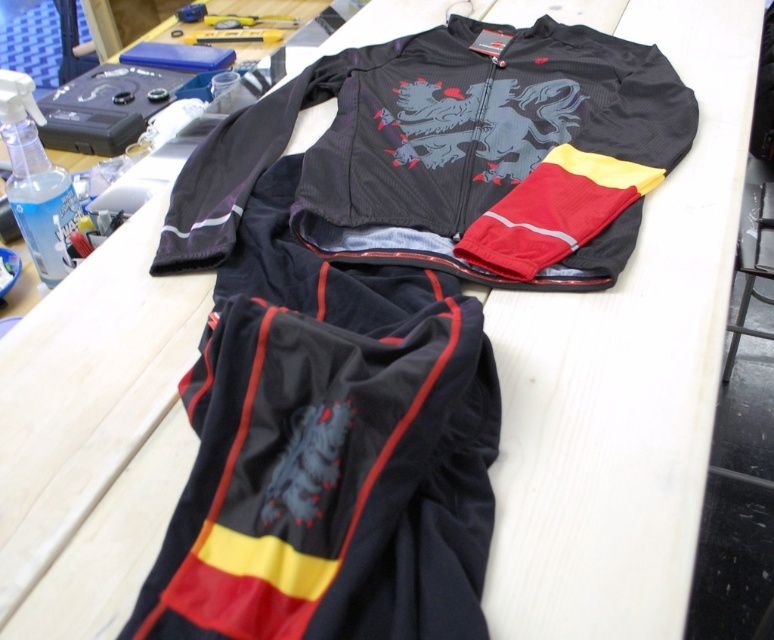
You are a customer at a sports store and see the black matte cycling suit at center and the matte black jacket at center displayed on a table. Which item is positioned lower on the table?

The black matte cycling suit at center is positioned below the matte black jacket at center, so it is lower on the table.

You are an athlete preparing for a race and need to choose between the black matte cycling suit at center and the matte black jacket at center. Which item is narrower?

The black matte cycling suit at center is narrower than the matte black jacket at center.